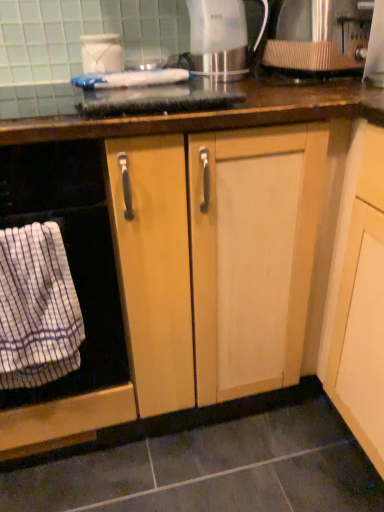
Question: From the image's perspective, is metallic silver kettle at upper center, acting as the 2th kitchen appliance starting from the right, above white glossy jar at upper center, the first kitchen appliance in the left-to-right sequence?

Choices:
 (A) no
 (B) yes

Answer: (B)

Question: Does metallic silver kettle at upper center, acting as the 2th kitchen appliance starting from the right, come behind white glossy jar at upper center, the first kitchen appliance in the left-to-right sequence?

Choices:
 (A) yes
 (B) no

Answer: (B)

Question: Is metallic silver kettle at upper center, which ranks as the 2th kitchen appliance in left-to-right order, taller than white glossy jar at upper center, the 3th kitchen appliance viewed from the right?

Choices:
 (A) yes
 (B) no

Answer: (A)

Question: Considering the relative sizes of metallic silver kettle at upper center, which ranks as the 2th kitchen appliance in left-to-right order, and white glossy jar at upper center, the 3th kitchen appliance viewed from the right, in the image provided, is metallic silver kettle at upper center, which ranks as the 2th kitchen appliance in left-to-right order, bigger than white glossy jar at upper center, the 3th kitchen appliance viewed from the right,?

Choices:
 (A) no
 (B) yes

Answer: (B)

Question: Is metallic silver kettle at upper center, acting as the 2th kitchen appliance starting from the right, smaller than white glossy jar at upper center, the 3th kitchen appliance viewed from the right?

Choices:
 (A) yes
 (B) no

Answer: (B)

Question: Are metallic silver kettle at upper center, which ranks as the 2th kitchen appliance in left-to-right order, and white glossy jar at upper center, the first kitchen appliance in the left-to-right sequence, beside each other?

Choices:
 (A) no
 (B) yes

Answer: (A)

Question: Is white striped towel at left further to the viewer compared to white glossy jar at upper center, the 3th kitchen appliance viewed from the right?

Choices:
 (A) no
 (B) yes

Answer: (A)

Question: Can you confirm if white striped towel at left is thinner than white glossy jar at upper center, the 3th kitchen appliance viewed from the right?

Choices:
 (A) yes
 (B) no

Answer: (B)

Question: Can you confirm if white striped towel at left is positioned to the left of white glossy jar at upper center, the 3th kitchen appliance viewed from the right?

Choices:
 (A) yes
 (B) no

Answer: (A)

Question: Considering the relative sizes of white striped towel at left and white glossy jar at upper center, the first kitchen appliance in the left-to-right sequence, in the image provided, is white striped towel at left taller than white glossy jar at upper center, the first kitchen appliance in the left-to-right sequence,?

Choices:
 (A) yes
 (B) no

Answer: (A)

Question: Does white striped towel at left have a smaller size compared to white glossy jar at upper center, the first kitchen appliance in the left-to-right sequence?

Choices:
 (A) no
 (B) yes

Answer: (A)

Question: Is the position of white striped towel at left less distant than that of white glossy jar at upper center, the first kitchen appliance in the left-to-right sequence?

Choices:
 (A) no
 (B) yes

Answer: (B)

Question: Is white striped cloth at left positioned beyond the bounds of white striped towel at left?

Choices:
 (A) no
 (B) yes

Answer: (A)